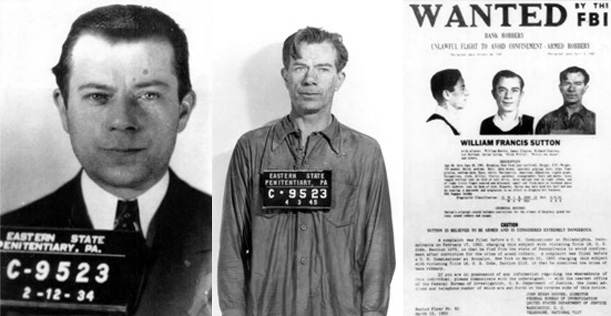
The width and height of the screenshot is (611, 316). In order to click on left eye of leftmost portrait in this screenshot , I will do `click(151, 96)`.